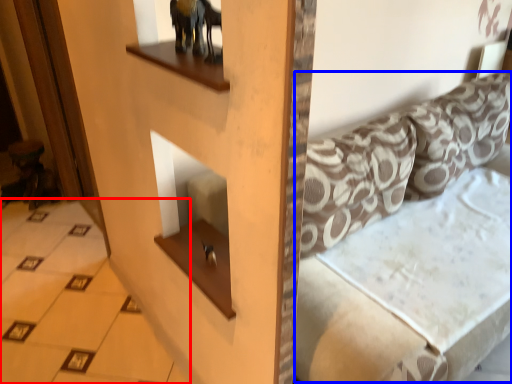
Question: Which point is further to the camera, tile (highlighted by a red box) or couch (highlighted by a blue box)?

Choices:
 (A) tile
 (B) couch

Answer: (A)